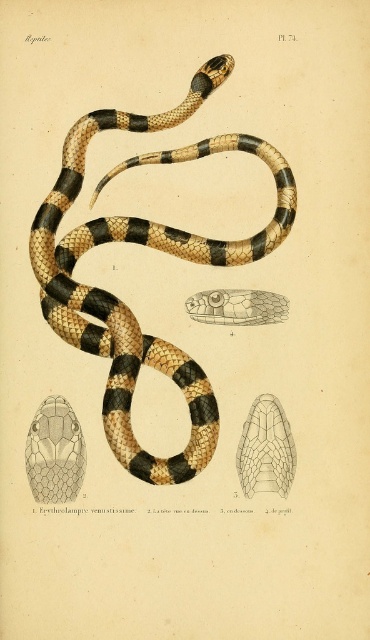
You are a researcher examining the illustration of the snake. You need to determine if you can see the brown and tan scales at center clearly with your naked eye from your current position. The minimum distance required for clear vision is 4 feet. Can you see them clearly?

The brown and tan scales at center are 4.16 feet away from the viewer. Since the minimum distance required for clear vision is 4 feet, the distance is sufficient, so yes, you can see them clearly.

You are an entomologist examining this illustration of a snake. You notice two features at the center of the image. One is the brown and tan scales at center and the other is the matte black snake head at upper center. Which of these features is taller in the illustration?

The brown and tan scales at center is taller than the matte black snake head at upper center according to the illustration.

You are an entomologist examining the illustration of the snake. You notice two distinct features in the center of the image. The first is the matte black snake head at upper center, and the second is the translucent yellow scales at center. Which of these two features is taller?

The matte black snake head at upper center is much taller than the translucent yellow scales at center.